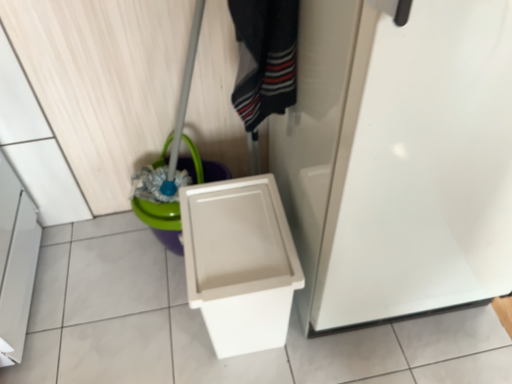
Question: Is striped cotton socks at center positioned beyond the bounds of green plastic bucket at lower left?

Choices:
 (A) yes
 (B) no

Answer: (A)

Question: Can you confirm if striped cotton socks at center is positioned to the left of green plastic bucket at lower left?

Choices:
 (A) no
 (B) yes

Answer: (A)

Question: From the image's perspective, does striped cotton socks at center appear lower than green plastic bucket at lower left?

Choices:
 (A) no
 (B) yes

Answer: (A)

Question: From the image's perspective, is striped cotton socks at center located above green plastic bucket at lower left?

Choices:
 (A) yes
 (B) no

Answer: (A)

Question: Can you confirm if striped cotton socks at center is wider than green plastic bucket at lower left?

Choices:
 (A) no
 (B) yes

Answer: (A)

Question: Is striped cotton socks at center facing towards green plastic bucket at lower left?

Choices:
 (A) yes
 (B) no

Answer: (B)

Question: Is white plastic toilet at lower right smaller than striped cotton socks at center?

Choices:
 (A) yes
 (B) no

Answer: (B)

Question: Does white plastic toilet at lower right have a greater height compared to striped cotton socks at center?

Choices:
 (A) yes
 (B) no

Answer: (A)

Question: Does white plastic toilet at lower right touch striped cotton socks at center?

Choices:
 (A) yes
 (B) no

Answer: (B)

Question: Can you confirm if white plastic toilet at lower right is positioned to the left of striped cotton socks at center?

Choices:
 (A) no
 (B) yes

Answer: (B)

Question: Considering the relative positions of white plastic toilet at lower right and striped cotton socks at center in the image provided, is white plastic toilet at lower right in front of striped cotton socks at center?

Choices:
 (A) yes
 (B) no

Answer: (B)

Question: From the image's perspective, is white plastic toilet at lower right below striped cotton socks at center?

Choices:
 (A) no
 (B) yes

Answer: (B)

Question: Is white plastic toilet at lower right shorter than white glossy screen door at center?

Choices:
 (A) yes
 (B) no

Answer: (A)